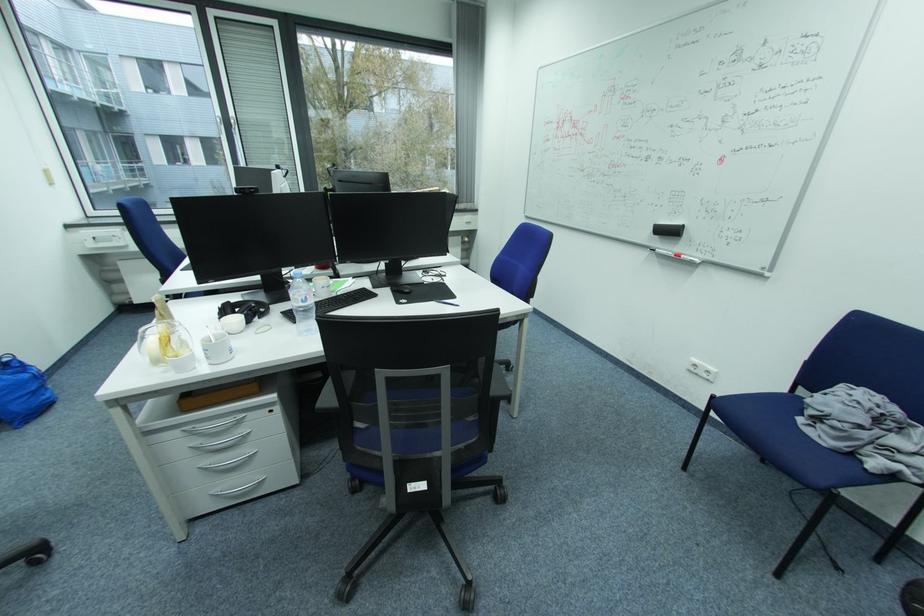
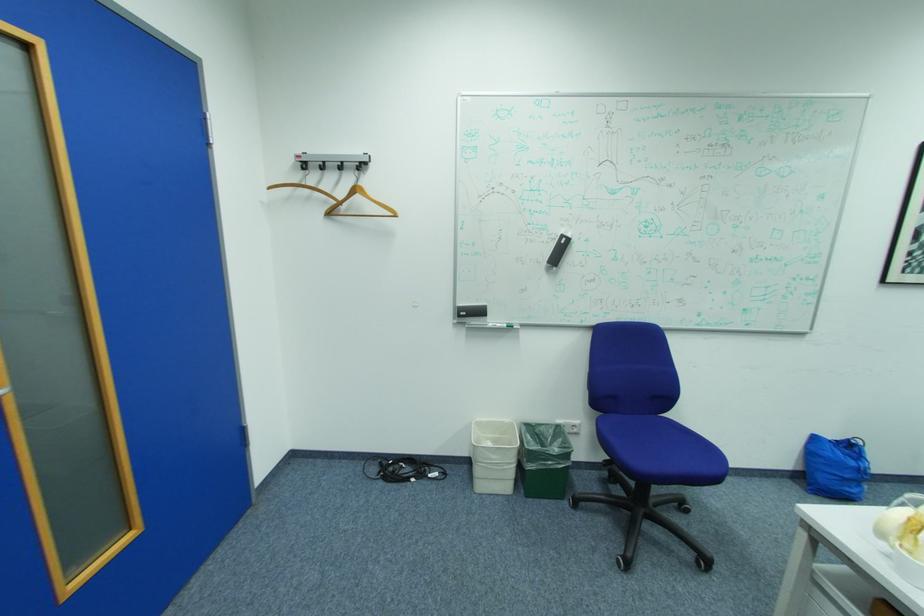
Where in the second image is the point corresponding to the point at 42,569 from the first image?

(703, 565)